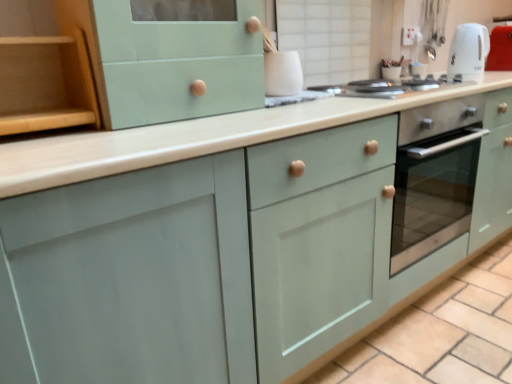
Locate an element on the screen. This screenshot has width=512, height=384. vacant area that lies to the right of white glossy kettle at upper center, the first appliance in the left-to-right sequence is located at coordinates (338, 97).